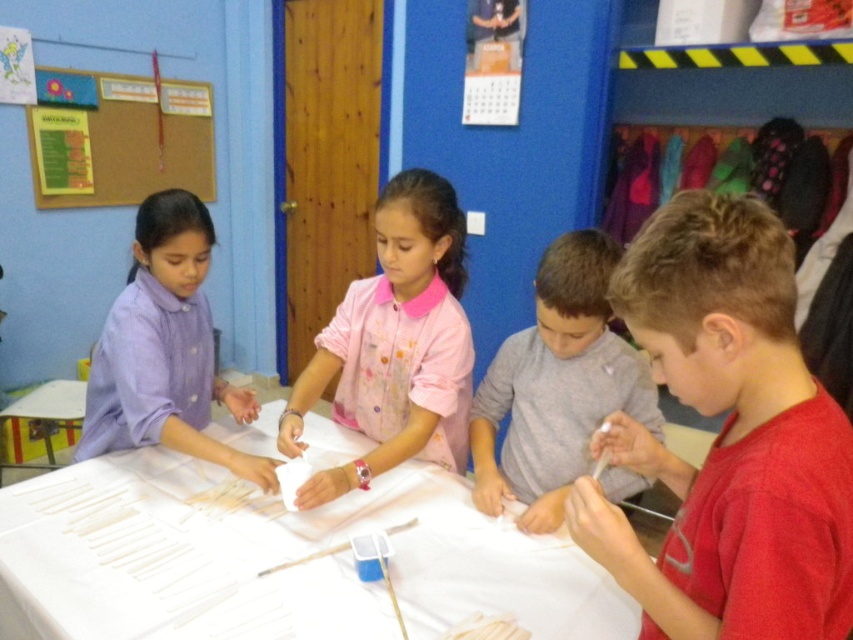
Question: Is white paper at center positioned in front of burlap bulletin board at upper left?

Choices:
 (A) yes
 (B) no

Answer: (A)

Question: Is white paper at center behind gray cotton shirt at center?

Choices:
 (A) yes
 (B) no

Answer: (B)

Question: Which point is farther from the camera taking this photo?

Choices:
 (A) (538, 260)
 (B) (753, 316)
 (C) (49, 634)

Answer: (A)

Question: Estimate the real-world distances between objects in this image. Which object is farther from the red matte shirt at right?

Choices:
 (A) purple cotton shirt at left
 (B) pink fabric shirt at center
 (C) gray cotton shirt at center
 (D) burlap bulletin board at upper left

Answer: (D)

Question: Which object is the closest to the burlap bulletin board at upper left?

Choices:
 (A) gray cotton shirt at center
 (B) purple cotton shirt at left
 (C) pink fabric shirt at center
 (D) white paper at center

Answer: (B)

Question: From the image, what is the correct spatial relationship of pink fabric shirt at center in relation to burlap bulletin board at upper left?

Choices:
 (A) above
 (B) below

Answer: (B)